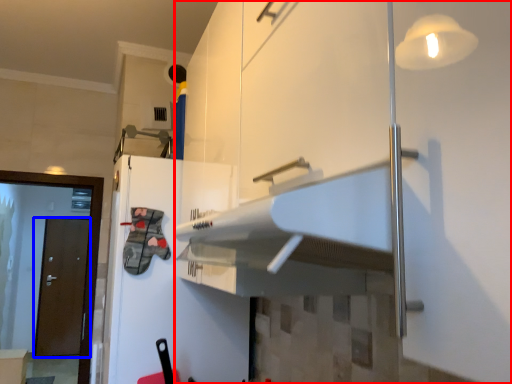
Question: Which object is closer to the camera taking this photo, cabinetry (highlighted by a red box) or door (highlighted by a blue box)?

Choices:
 (A) cabinetry
 (B) door

Answer: (A)